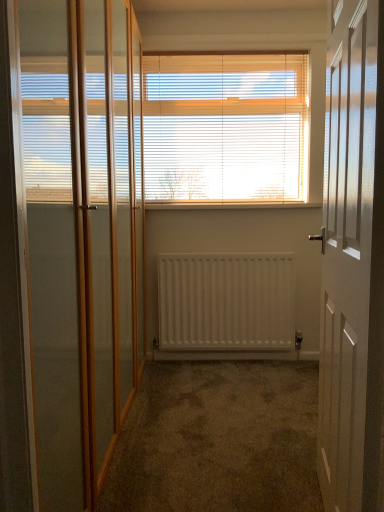
Question: From the image's perspective, is white wooden door at right located above wooden at center?

Choices:
 (A) yes
 (B) no

Answer: (B)

Question: Can you confirm if white wooden door at right is taller than wooden at center?

Choices:
 (A) yes
 (B) no

Answer: (A)

Question: Would you say white wooden door at right contains wooden at center?

Choices:
 (A) yes
 (B) no

Answer: (B)

Question: Is white wooden door at right not inside wooden at center?

Choices:
 (A) no
 (B) yes

Answer: (B)

Question: Is wooden at center at the back of white wooden door at right?

Choices:
 (A) yes
 (B) no

Answer: (B)

Question: Does white wooden door at right have a lesser height compared to wooden at center?

Choices:
 (A) yes
 (B) no

Answer: (B)

Question: Considering the relative positions of clear glass screen door at left and white wood blinds at center in the image provided, is clear glass screen door at left in front of white wood blinds at center?

Choices:
 (A) no
 (B) yes

Answer: (B)

Question: From a real-world perspective, is clear glass screen door at left over white wood blinds at center?

Choices:
 (A) no
 (B) yes

Answer: (A)

Question: Is clear glass screen door at left smaller than white wood blinds at center?

Choices:
 (A) yes
 (B) no

Answer: (B)

Question: Considering the relative positions of clear glass screen door at left and white wood blinds at center in the image provided, is clear glass screen door at left to the right of white wood blinds at center from the viewer's perspective?

Choices:
 (A) yes
 (B) no

Answer: (B)

Question: Would you say clear glass screen door at left is a long distance from white wood blinds at center?

Choices:
 (A) no
 (B) yes

Answer: (B)

Question: Can you confirm if clear glass screen door at left is positioned to the left of white wood blinds at center?

Choices:
 (A) no
 (B) yes

Answer: (B)

Question: Does white wood blinds at center have a greater width compared to white matte radiator at center?

Choices:
 (A) no
 (B) yes

Answer: (A)